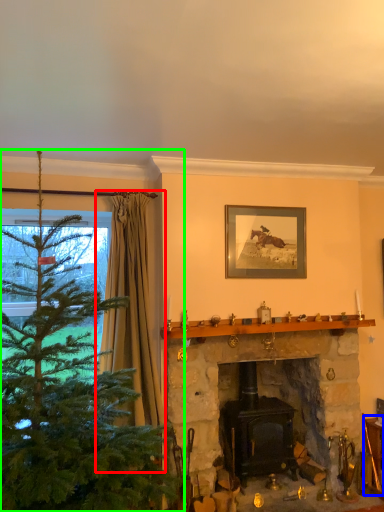
Question: Which object is the farthest from curtain (highlighted by a red box)? Choose among these: furniture (highlighted by a blue box) or christmas tree (highlighted by a green box).

Choices:
 (A) furniture
 (B) christmas tree

Answer: (A)